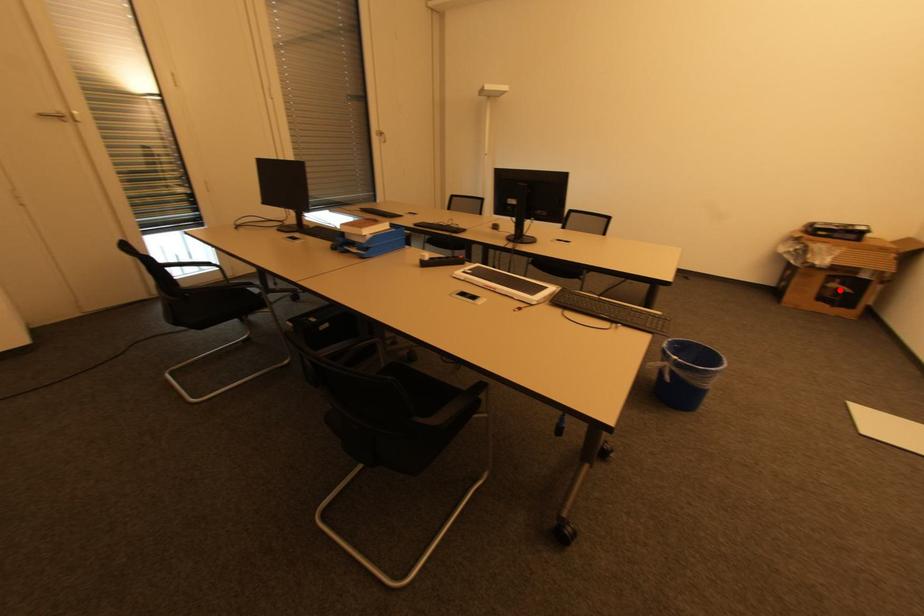
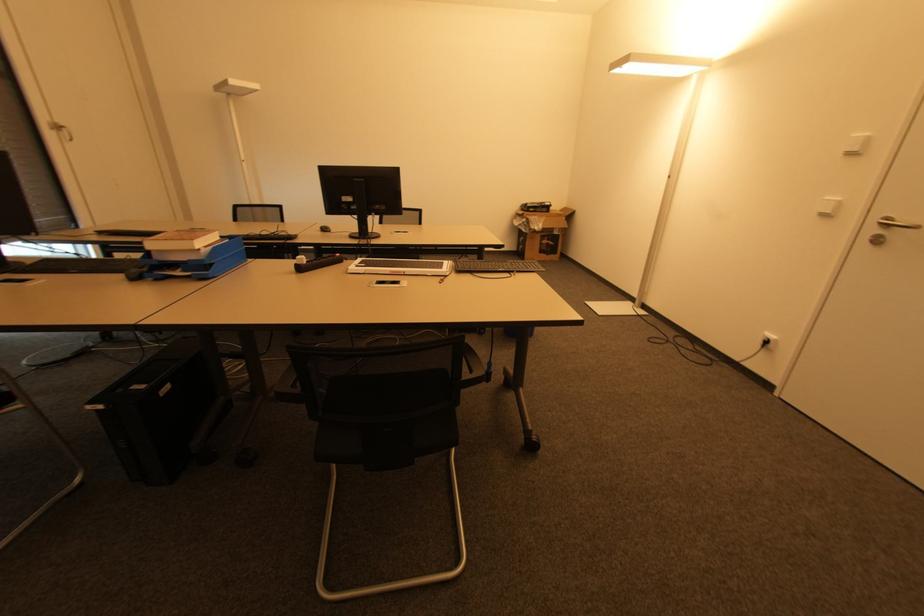
Question: I am providing you with two images of the same scene from different viewpoints. A red point is marked on the first image. Is the red point's position out of view in image 2?

Choices:
 (A) Yes
 (B) No

Answer: (B)